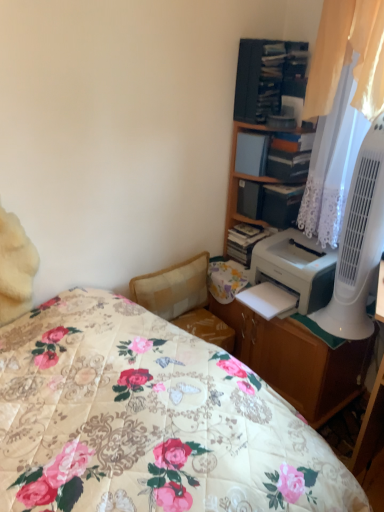
Question: Do you think matte white book at upper right, the first book positioned from the left, is within matte plastic shelf at upper right, the 1th shelf in the bottom-to-top sequence, or outside of it?

Choices:
 (A) inside
 (B) outside

Answer: (B)

Question: From the image's perspective, is matte white book at upper right, the 2th book viewed from the right, positioned above or below matte plastic shelf at upper right, the 1th shelf in the bottom-to-top sequence?

Choices:
 (A) above
 (B) below

Answer: (A)

Question: Which of these objects is positioned closest to the wooden cabinet at upper right?

Choices:
 (A) wooden desk at center
 (B) hardcover book at upper right, the 1th book viewed from the right
 (C) wooden bookshelf at upper right, which appears as the 1th shelf when viewed from the top
 (D) matte plastic shelf at upper right, the 1th shelf in the bottom-to-top sequence
 (E) matte white book at upper right, the first book positioned from the left

Answer: (C)

Question: Which of these objects is positioned farthest from the white plastic fan at right?

Choices:
 (A) white lace curtain at upper right
 (B) matte plastic shelf at upper right, marked as the 2th shelf in a top-to-bottom arrangement
 (C) wooden cabinet at upper right
 (D) hardcover book at upper right, the 1th book viewed from the right
 (E) matte white book at upper right, the 2th book viewed from the right

Answer: (E)